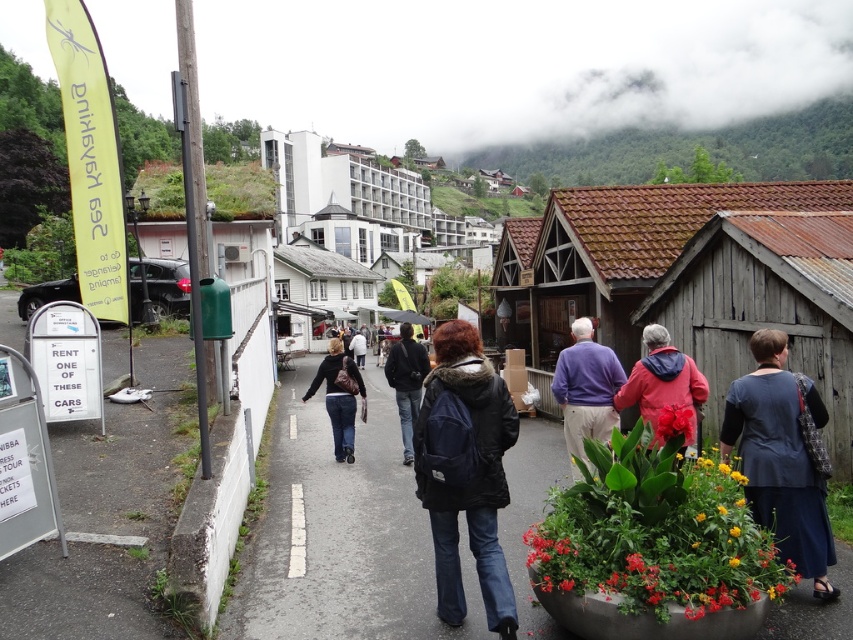
You are standing at the center of the street looking towards the large white building in the background. Where is the red matte flower pot at lower right located relative to your position?

The red matte flower pot at lower right is located at point (654,532) relative to your position.